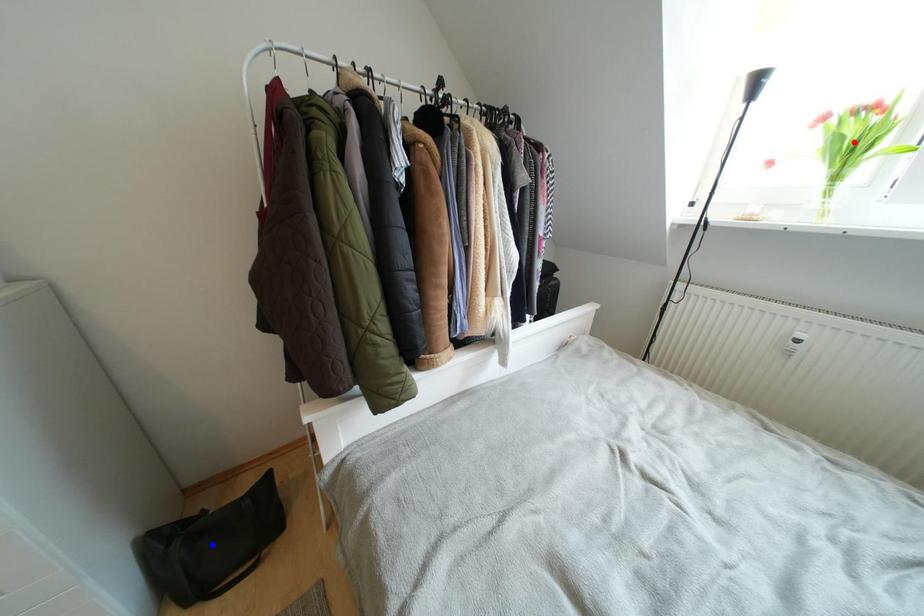
Question: In the image, two points are highlighted. Which point is nearer to the camera? Reply with the corresponding letter.

Choices:
 (A) blue point
 (B) red point

Answer: (B)